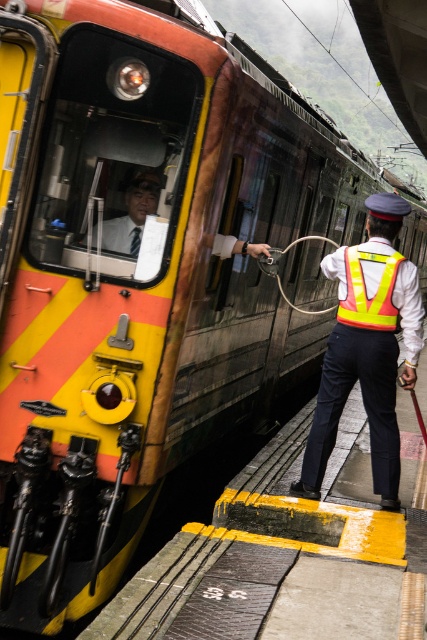
Question: Among these objects, which one is nearest to the camera?

Choices:
 (A) matte black tie at center
 (B) reflective yellow vest at center
 (C) yellow reflective safety vest at center

Answer: (A)

Question: Is reflective yellow vest at center below matte black tie at center?

Choices:
 (A) yes
 (B) no

Answer: (A)

Question: Among these points, which one is farthest from the camera?

Choices:
 (A) click(359, 252)
 (B) click(348, 346)
 (C) click(134, 193)

Answer: (B)

Question: Which of the following is the farthest from the observer?

Choices:
 (A) matte black tie at center
 (B) reflective yellow vest at center
 (C) yellow reflective safety vest at center

Answer: (C)

Question: Can you confirm if reflective yellow vest at center is thinner than yellow reflective safety vest at center?

Choices:
 (A) yes
 (B) no

Answer: (B)

Question: Is reflective yellow vest at center closer to the viewer compared to matte black tie at center?

Choices:
 (A) no
 (B) yes

Answer: (A)